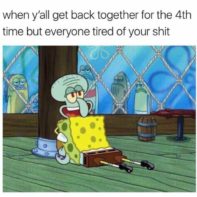
You are a GUI agent. You are given a task and a screenshot of the screen. Output one action in this format:
    pyautogui.click(x=<x>, y=<y>)
    Task: Click on the floor
    
    Given the screenshot: What is the action you would take?
    pyautogui.click(x=49, y=176)